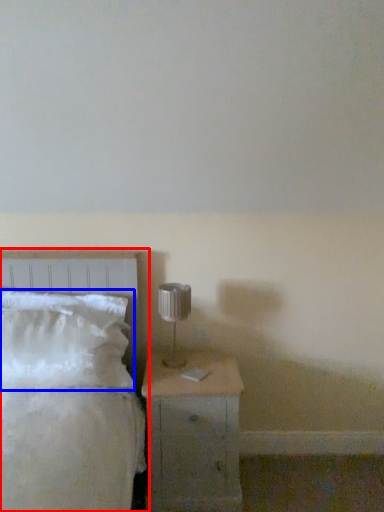
Question: Among these objects, which one is farthest to the camera, bed (highlighted by a red box) or pillow (highlighted by a blue box)?

Choices:
 (A) bed
 (B) pillow

Answer: (B)